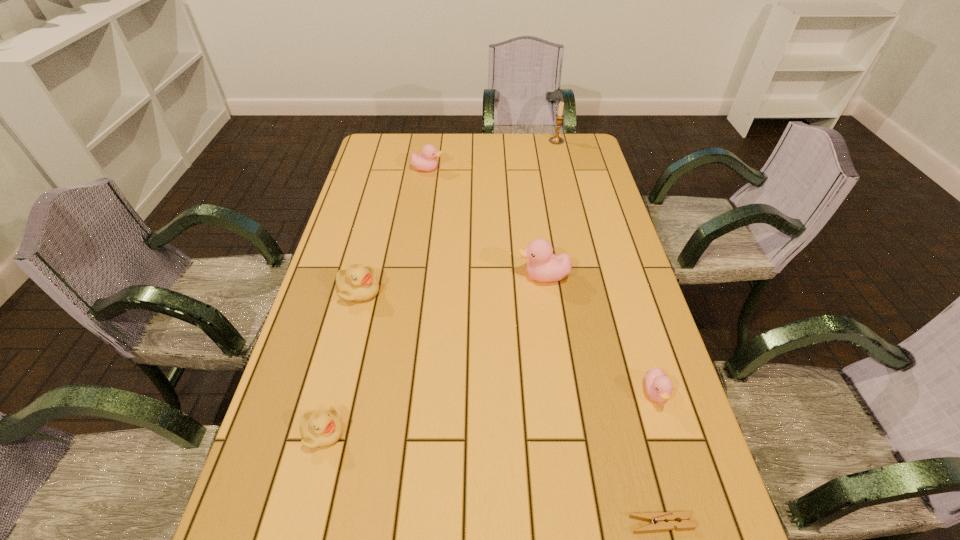
I want to click on the closest duckling to the rightmost duckling, so point(543,266).

Identify the location of the closest duckling relative to the biggest pink duckling. (x=658, y=385).

Locate an element on the screen. the second closest pink duckling to the second farthest object is located at coordinates (658, 385).

The height and width of the screenshot is (540, 960). In order to click on the second closest pink duckling to the fifth object from right to left in this screenshot , I will do `click(658, 385)`.

Identify the location of vacant region that satisfies the following two spatial constraints: 1. on the front-facing side of the clothespin; 2. on the right side of the third duckling from left to right. (373, 523).

Find the location of a particular element. This screenshot has height=540, width=960. free space that satisfies the following two spatial constraints: 1. on the front-facing side of the shortest object; 2. on the right side of the leftmost pink duckling is located at coordinates (373, 523).

Image resolution: width=960 pixels, height=540 pixels. In order to click on vacant space that satisfies the following two spatial constraints: 1. on the front-facing side of the clothespin; 2. on the left side of the leftmost pink duckling in this screenshot , I will do `click(373, 523)`.

Identify the location of vacant space that satisfies the following two spatial constraints: 1. on the front-facing side of the shortest object; 2. on the left side of the second duckling from right to left. This screenshot has width=960, height=540. (578, 523).